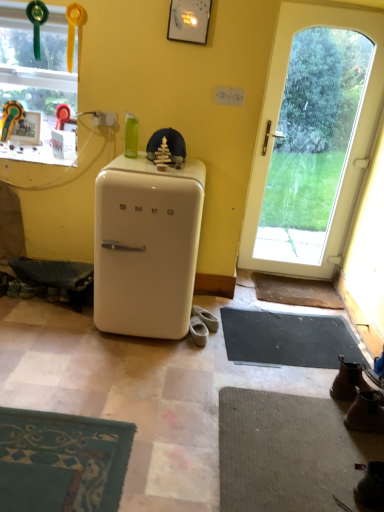
Locate an element on the screen. The height and width of the screenshot is (512, 384). free space above brown leather doormat at lower right (from a real-world perspective) is located at coordinates 301,291.